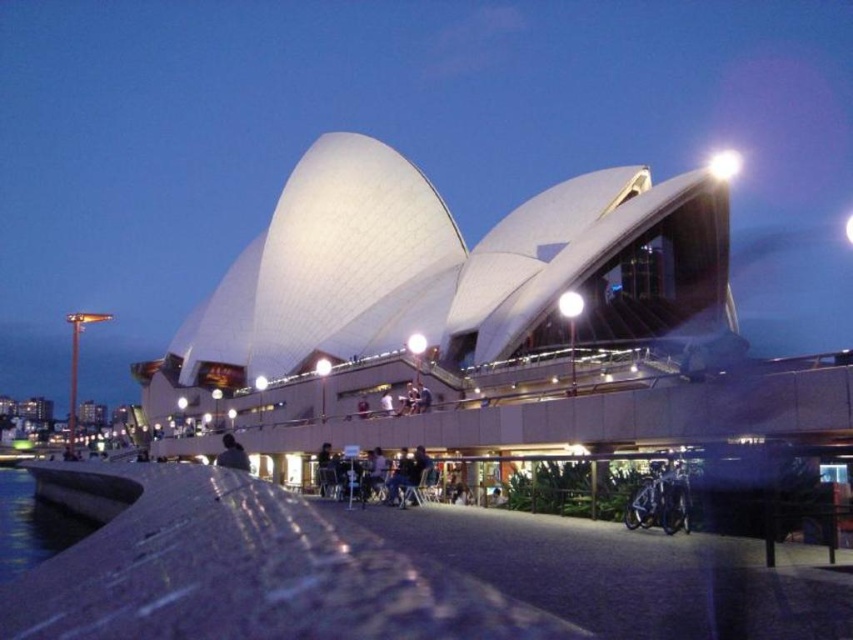
Question: Among these objects, which one is farthest from the camera?

Choices:
 (A) light brown wooden chair at lower center
 (B) clear water at lower left

Answer: (A)

Question: Does clear water at lower left have a smaller size compared to light brown wooden chair at lower center?

Choices:
 (A) yes
 (B) no

Answer: (B)

Question: Does clear water at lower left come in front of light brown wooden chair at lower center?

Choices:
 (A) no
 (B) yes

Answer: (B)

Question: Which point is farther to the camera?

Choices:
 (A) light brown wooden chair at lower center
 (B) clear water at lower left

Answer: (A)

Question: Is clear water at lower left closer to the viewer compared to light brown wooden chair at lower center?

Choices:
 (A) yes
 (B) no

Answer: (A)